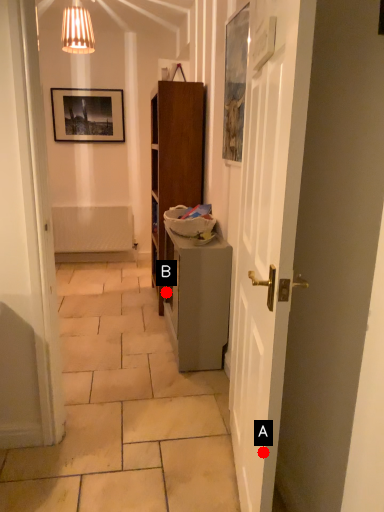
Question: Two points are circled on the image, labeled by A and B beside each circle. Among these points, which one is nearest to the camera?

Choices:
 (A) A is closer
 (B) B is closer

Answer: (A)